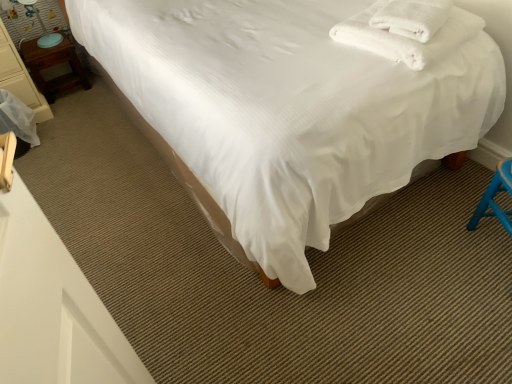
What do you see at coordinates (408, 30) in the screenshot? This screenshot has width=512, height=384. I see `white soft towel at upper right` at bounding box center [408, 30].

In order to face wooden nightstand at left, should I rotate leftwards or rightwards?

It's best to rotate left around 25.206 degrees.

The image size is (512, 384). Find the location of `wooden nightstand at left`. wooden nightstand at left is located at coordinates (20, 78).

Identify the location of white soft towel at upper right. (408, 30).

Considering the sizes of objects white soft towel at upper right and wooden nightstand at left in the image provided, who is bigger, white soft towel at upper right or wooden nightstand at left?

With larger size is wooden nightstand at left.

Considering the relative positions of white soft towel at upper right and wooden nightstand at left in the image provided, is white soft towel at upper right to the left of wooden nightstand at left from the viewer's perspective?

Incorrect, white soft towel at upper right is not on the left side of wooden nightstand at left.

Which of these two, white soft towel at upper right or wooden nightstand at left, stands taller?

Standing taller between the two is wooden nightstand at left.

Is white soft towel at upper right spatially inside wooden nightstand at left, or outside of it?

white soft towel at upper right is not inside wooden nightstand at left, it's outside.

Is matte blue table lamp at left situated inside wooden nightstand at left or outside?

matte blue table lamp at left lies outside wooden nightstand at left.

Would you say matte blue table lamp at left is a long distance from wooden nightstand at left?

No, there isn't a large distance between matte blue table lamp at left and wooden nightstand at left.

Can you tell me how much matte blue table lamp at left and wooden nightstand at left differ in facing direction?

The angle between the facing direction of matte blue table lamp at left and the facing direction of wooden nightstand at left is 0.0333 degrees.

Is matte blue table lamp at left at the left side of wooden nightstand at left?

Incorrect, matte blue table lamp at left is not on the left side of wooden nightstand at left.

Does wooden nightstand at left appear on the left side of white smooth bed at center?

Yes, wooden nightstand at left is to the left of white smooth bed at center.

Is point (18, 96) positioned before point (280, 208)?

No, it is behind (280, 208).

Consider the image. Does wooden nightstand at left have a lesser height compared to white smooth bed at center?

Correct, wooden nightstand at left is not as tall as white smooth bed at center.

Is wooden nightstand at left taller or shorter than matte blue table lamp at left?

Clearly, wooden nightstand at left is shorter compared to matte blue table lamp at left.

Between wooden nightstand at left and matte blue table lamp at left, which one appears on the right side from the viewer's perspective?

matte blue table lamp at left is more to the right.

Is wooden nightstand at left bigger or smaller than matte blue table lamp at left?

Considering their sizes, wooden nightstand at left takes up more space than matte blue table lamp at left.

Is wooden nightstand at left oriented away from white soft towel at upper right?

No, white soft towel at upper right is not at the back of wooden nightstand at left.

From the image's perspective, between wooden nightstand at left and white soft towel at upper right, which one is located above?

wooden nightstand at left.

In the scene shown: Considering the relative positions of wooden nightstand at left and white soft towel at upper right in the image provided, is wooden nightstand at left to the left of white soft towel at upper right from the viewer's perspective?

Correct, you'll find wooden nightstand at left to the left of white soft towel at upper right.

What are the coordinates of `bed positioned vertically above the matte blue table lamp at left (from a real-world perspective)` in the screenshot? It's located at (288, 109).

Would you say matte blue table lamp at left is outside white smooth bed at center?

Indeed, matte blue table lamp at left is completely outside white smooth bed at center.

Considering the relative sizes of matte blue table lamp at left and white smooth bed at center in the image provided, is matte blue table lamp at left thinner than white smooth bed at center?

Indeed, matte blue table lamp at left has a lesser width compared to white smooth bed at center.

Is wooden nightstand at left shorter than matte blue table lamp at left?

No, wooden nightstand at left is not shorter than matte blue table lamp at left.

From a real-world perspective, is wooden nightstand at left located beneath matte blue table lamp at left?

Yes, from a real-world perspective, wooden nightstand at left is beneath matte blue table lamp at left.

From the image's perspective, which is below, wooden nightstand at left or matte blue table lamp at left?

wooden nightstand at left.

Does wooden nightstand at left have a smaller size compared to matte blue table lamp at left?

Actually, wooden nightstand at left might be larger than matte blue table lamp at left.

Locate an element on the screen. blanket to the right of wooden nightstand at left is located at coordinates (408, 30).

What are the coordinates of `furniture on the left of matte blue table lamp at left` in the screenshot? It's located at (20, 78).

Looking at the image, which one is located further to matte blue table lamp at left, white smooth bed at center or wooden nightstand at left?

white smooth bed at center is positioned further to the anchor matte blue table lamp at left.

Estimate the real-world distances between objects in this image. Which object is further from white soft towel at upper right, matte blue table lamp at left or wooden nightstand at left?

matte blue table lamp at left lies further to white soft towel at upper right than the other object.

Considering their positions, is wooden nightstand at left positioned closer to white soft towel at upper right than wooden nightstand at left?

Among the two, wooden nightstand at left is located nearer to white soft towel at upper right.

When comparing their distances from wooden nightstand at left, does white smooth bed at center or wooden nightstand at left seem closer?

Based on the image, wooden nightstand at left appears to be nearer to wooden nightstand at left.

Estimate the real-world distances between objects in this image. Which object is further from white soft towel at upper right, wooden nightstand at left or white smooth bed at center?

wooden nightstand at left lies further to white soft towel at upper right than the other object.

Based on their spatial positions, is wooden nightstand at left or matte blue table lamp at left further from white smooth bed at center?

Among the two, matte blue table lamp at left is located further to white smooth bed at center.

Estimate the real-world distances between objects in this image. Which object is closer to wooden nightstand at left, matte blue table lamp at left or white smooth bed at center?

matte blue table lamp at left.

When comparing their distances from white smooth bed at center, does wooden nightstand at left or wooden nightstand at left seem closer?

The object closer to white smooth bed at center is wooden nightstand at left.

At what (x,y) coordinates should I click in order to perform the action: click on furniture between white smooth bed at center and matte blue table lamp at left along the z-axis. Please return your answer as a coordinate pair (x, y). Looking at the image, I should click on 20,78.

The height and width of the screenshot is (384, 512). In order to click on bed between matte blue table lamp at left and white soft towel at upper right in the horizontal direction in this screenshot , I will do `click(288, 109)`.

This screenshot has height=384, width=512. What are the coordinates of `table lamp situated between wooden nightstand at left and white soft towel at upper right from left to right` in the screenshot? It's located at (42, 27).

Where is `bed between wooden nightstand at left and white soft towel at upper right from left to right`? The width and height of the screenshot is (512, 384). bed between wooden nightstand at left and white soft towel at upper right from left to right is located at coordinates (288, 109).